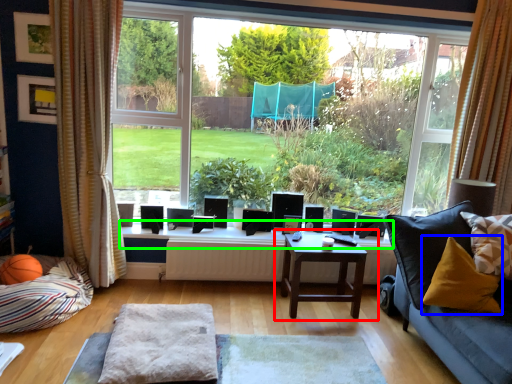
Question: Which is farther away from table (highlighted by a red box)? pillow (highlighted by a blue box) or window sill (highlighted by a green box)?

Choices:
 (A) pillow
 (B) window sill

Answer: (A)